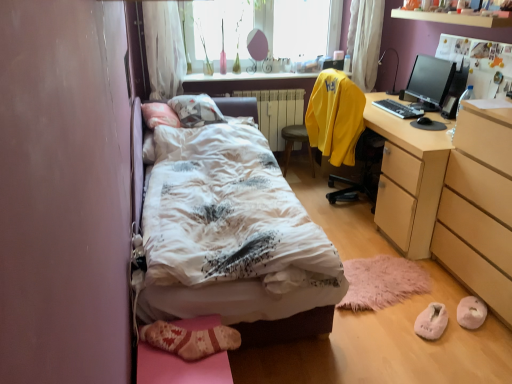
Question: Does yellow matte sweatshirt at upper right have a larger size compared to yellow fabric chair at center?

Choices:
 (A) no
 (B) yes

Answer: (B)

Question: From the image's perspective, is yellow matte sweatshirt at upper right above yellow fabric chair at center?

Choices:
 (A) yes
 (B) no

Answer: (A)

Question: Is the depth of yellow matte sweatshirt at upper right greater than that of yellow fabric chair at center?

Choices:
 (A) no
 (B) yes

Answer: (A)

Question: Is yellow matte sweatshirt at upper right wider than yellow fabric chair at center?

Choices:
 (A) no
 (B) yes

Answer: (B)

Question: Would you consider yellow matte sweatshirt at upper right to be distant from yellow fabric chair at center?

Choices:
 (A) yes
 (B) no

Answer: (B)

Question: Can you see yellow matte sweatshirt at upper right touching yellow fabric chair at center?

Choices:
 (A) yes
 (B) no

Answer: (B)

Question: From the image's perspective, would you say black glossy monitor at upper right is shown under white printed fabric bed at center?

Choices:
 (A) no
 (B) yes

Answer: (A)

Question: From the image's perspective, would you say black glossy monitor at upper right is positioned over white printed fabric bed at center?

Choices:
 (A) no
 (B) yes

Answer: (B)

Question: Considering the relative sizes of black glossy monitor at upper right and white printed fabric bed at center in the image provided, is black glossy monitor at upper right taller than white printed fabric bed at center?

Choices:
 (A) yes
 (B) no

Answer: (A)

Question: Would you say black glossy monitor at upper right contains white printed fabric bed at center?

Choices:
 (A) no
 (B) yes

Answer: (A)

Question: From a real-world perspective, is black glossy monitor at upper right positioned under white printed fabric bed at center based on gravity?

Choices:
 (A) yes
 (B) no

Answer: (B)

Question: Is black glossy monitor at upper right aimed at white printed fabric bed at center?

Choices:
 (A) yes
 (B) no

Answer: (A)

Question: Is wooden shelf at upper center oriented towards white sheer curtain at upper center, which ranks as the 1th curtain in right-to-left order?

Choices:
 (A) yes
 (B) no

Answer: (B)